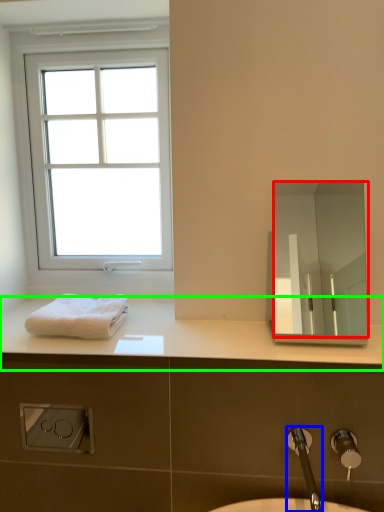
Question: Considering the real-world distances, which object is closest to mirror (highlighted by a red box)? tap (highlighted by a blue box) or counter top (highlighted by a green box).

Choices:
 (A) tap
 (B) counter top

Answer: (B)